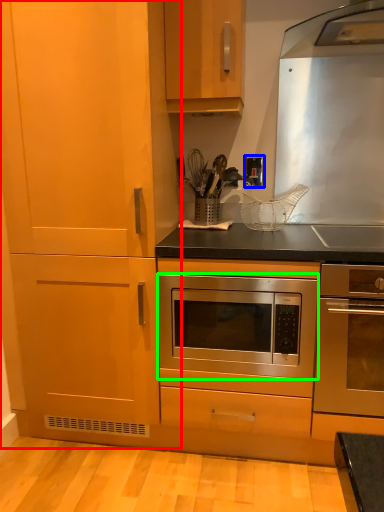
Question: Based on their relative distances, which object is nearer to cabinetry (highlighted by a red box)? Choose from electric outlet (highlighted by a blue box) and oven (highlighted by a green box).

Choices:
 (A) electric outlet
 (B) oven

Answer: (B)